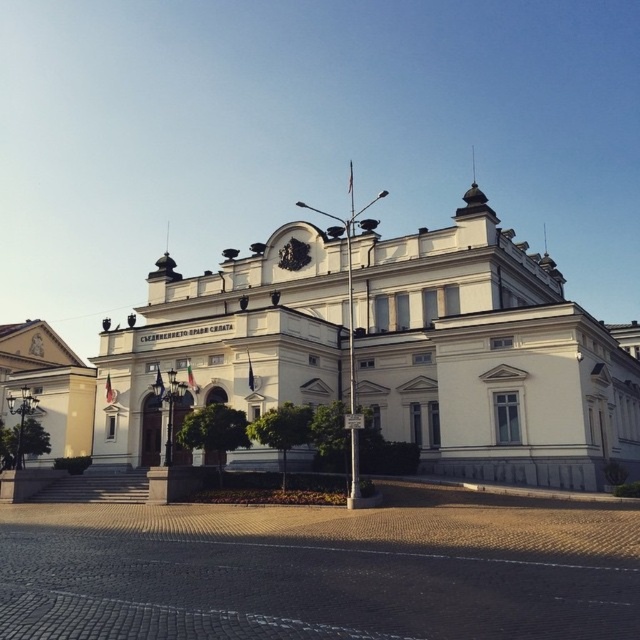
Question: Can you confirm if white stone building at center is thinner than white stone building at lower left?

Choices:
 (A) yes
 (B) no

Answer: (B)

Question: Observing the image, what is the correct spatial positioning of white stone building at center in reference to white stone building at lower left?

Choices:
 (A) below
 (B) above

Answer: (B)

Question: Does white stone building at center come in front of white stone building at lower left?

Choices:
 (A) yes
 (B) no

Answer: (A)

Question: Among these points, which one is nearest to the camera?

Choices:
 (A) (508, 342)
 (B) (60, 433)

Answer: (A)